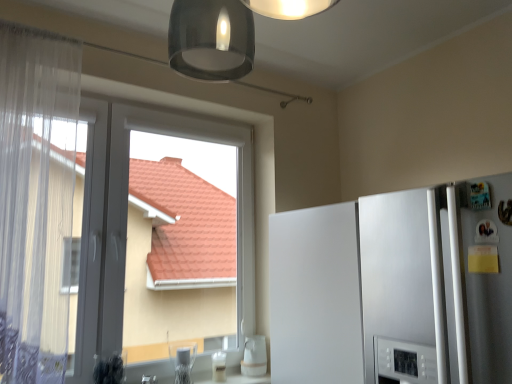
I want to click on vacant space behind white glossy cup at lower center, arranged as the first appliance when viewed from the left, so click(x=197, y=377).